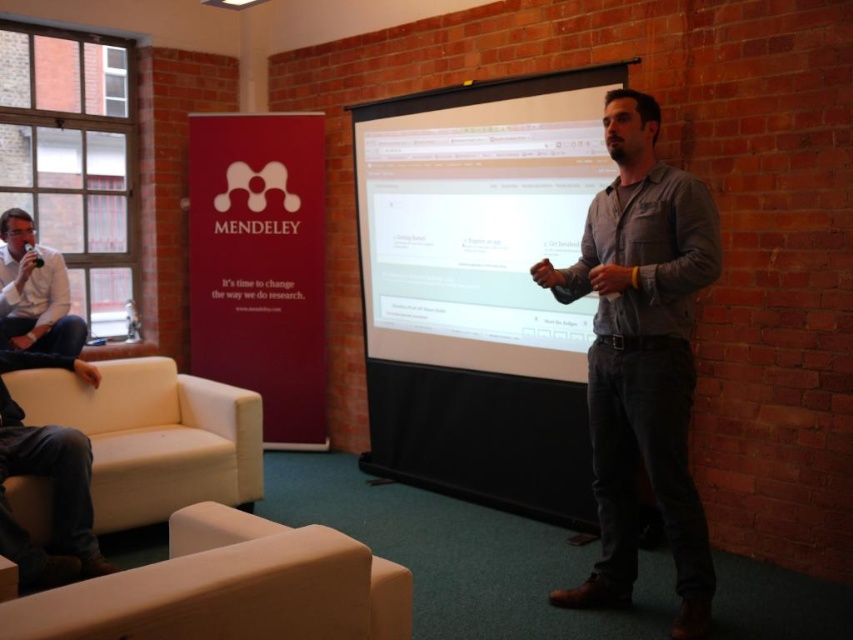
Is white glossy projection screen at center closer to the viewer compared to beige fabric armchair at lower left?

No.

From the picture: Does white glossy projection screen at center have a greater width compared to beige fabric armchair at lower left?

Correct, the width of white glossy projection screen at center exceeds that of beige fabric armchair at lower left.

Where is `white glossy projection screen at center`? The width and height of the screenshot is (853, 640). white glossy projection screen at center is located at coordinates (479, 220).

Is point (657, 168) farther from viewer compared to point (105, 451)?

No, it is not.

Between gray cotton shirt at center and white leather armchair at lower left, which one appears on the right side from the viewer's perspective?

From the viewer's perspective, gray cotton shirt at center appears more on the right side.

Describe the element at coordinates (642, 356) in the screenshot. The image size is (853, 640). I see `gray cotton shirt at center` at that location.

Find the location of `gray cotton shirt at center`. gray cotton shirt at center is located at coordinates (642, 356).

Is beige fabric armchair at lower left to the right of white shirt at left from the viewer's perspective?

Correct, you'll find beige fabric armchair at lower left to the right of white shirt at left.

Is beige fabric armchair at lower left smaller than white shirt at left?

Incorrect, beige fabric armchair at lower left is not smaller in size than white shirt at left.

Is point (183, 573) closer to viewer compared to point (20, 348)?

Yes.

The height and width of the screenshot is (640, 853). Identify the location of beige fabric armchair at lower left. (229, 588).